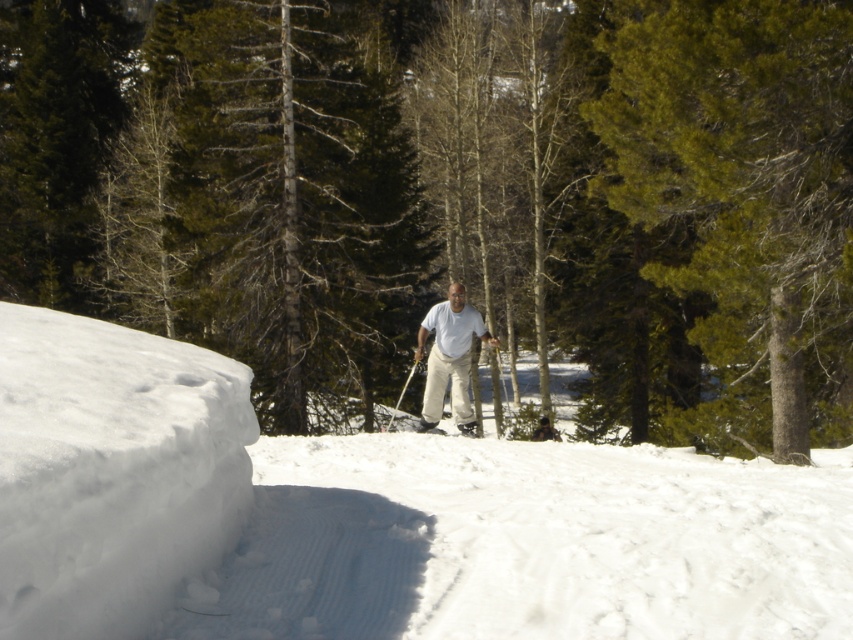
Question: Which object is farther from the camera taking this photo?

Choices:
 (A) green needle-like at center
 (B) smooth black ski pole at center

Answer: (B)

Question: Estimate the real-world distances between objects in this image. Which object is farther from the white fluffy snow at center?

Choices:
 (A) light beige pants at center
 (B) smooth black ski pole at center
 (C) green needle-like at center

Answer: (B)

Question: Among these points, which one is farthest from the camera?

Choices:
 (A) (787, 344)
 (B) (287, 502)

Answer: (A)

Question: Can you confirm if green textured pine tree at center is wider than white fluffy snow at center?

Choices:
 (A) yes
 (B) no

Answer: (A)

Question: Is green textured pine tree at center thinner than smooth black ski pole at center?

Choices:
 (A) yes
 (B) no

Answer: (B)

Question: Is green textured pine tree at center thinner than green needle-like at center?

Choices:
 (A) yes
 (B) no

Answer: (B)